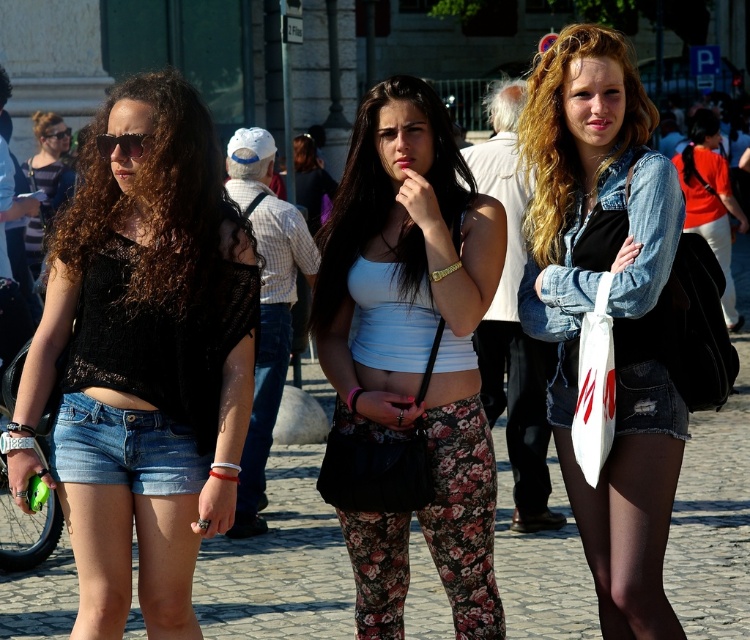
You are a photographer trying to capture a photo of the matte black top at left and the denim jacket at lower right. Which object is closer to the camera?

The matte black top at left is closer to the camera because the denim jacket at lower right is behind it.

You are a photographer trying to capture both the black mesh top at center and the denim jacket at lower right in the same frame. Based on their positions, which one should you adjust your camera angle to focus on first to ensure both are in the shot?

The black mesh top at center is to the left of the denim jacket at lower right, so you should focus on the black mesh top at center first to ensure both are in the frame.

You are a fashion designer observing the two clothing items worn by the middle woman in the scene. Which clothing item, the white matte tank top at center or the denim jacket at center, has a greater height measurement?

The white matte tank top at center is taller than the denim jacket at center.